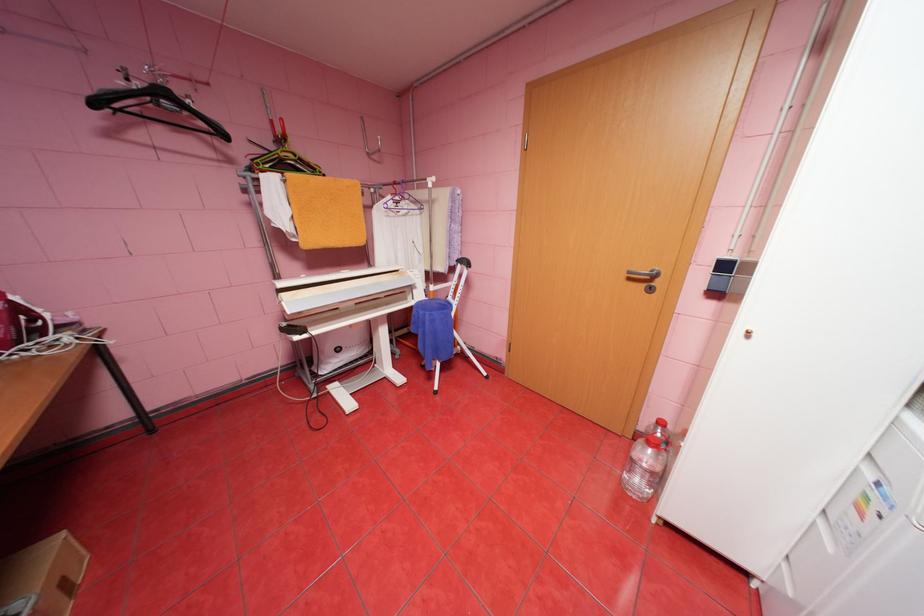
The image size is (924, 616). Describe the element at coordinates (748, 334) in the screenshot. I see `the small brass knob` at that location.